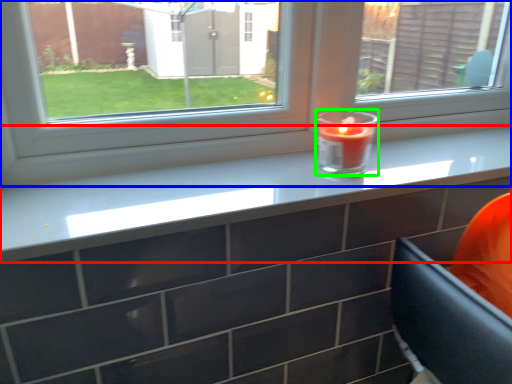
Question: Which object is the farthest from counter top (highlighted by a red box)? Choose among these: window (highlighted by a blue box) or birthday candle (highlighted by a green box).

Choices:
 (A) window
 (B) birthday candle

Answer: (B)